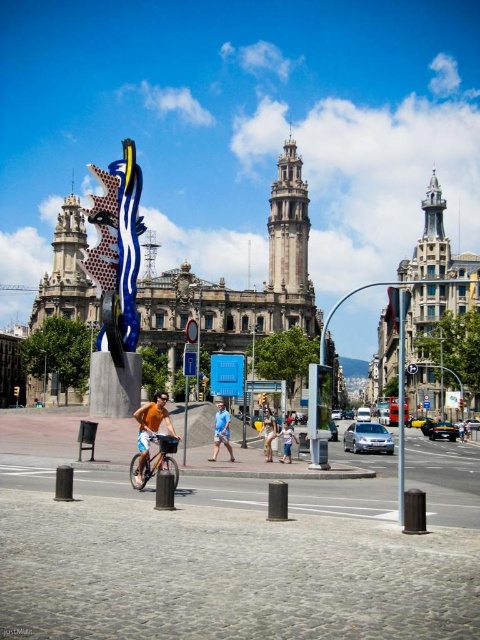
Question: Can you confirm if polychrome painted ceramic mask at center-left is positioned above metallic pole at center-right?

Choices:
 (A) yes
 (B) no

Answer: (A)

Question: Based on their relative distances, which object is nearer to the light blue denim shorts at center?

Choices:
 (A) polychrome painted ceramic mask at center-left
 (B) denim pants at center

Answer: (B)

Question: Among these points, which one is farthest from the camera?

Choices:
 (A) (228, 452)
 (B) (274, 432)
 (C) (283, 433)

Answer: (B)

Question: Is metallic pole at center-right to the left of blue cotton shirt at center from the viewer's perspective?

Choices:
 (A) no
 (B) yes

Answer: (A)

Question: Which object is closer to the camera taking this photo?

Choices:
 (A) light blue denim shorts at center
 (B) metallic pole at center-right
 (C) denim pants at center
 (D) blue cotton shirt at center

Answer: (B)

Question: Can you confirm if orange cotton shirt at center is positioned below metallic pole at center-right?

Choices:
 (A) yes
 (B) no

Answer: (A)